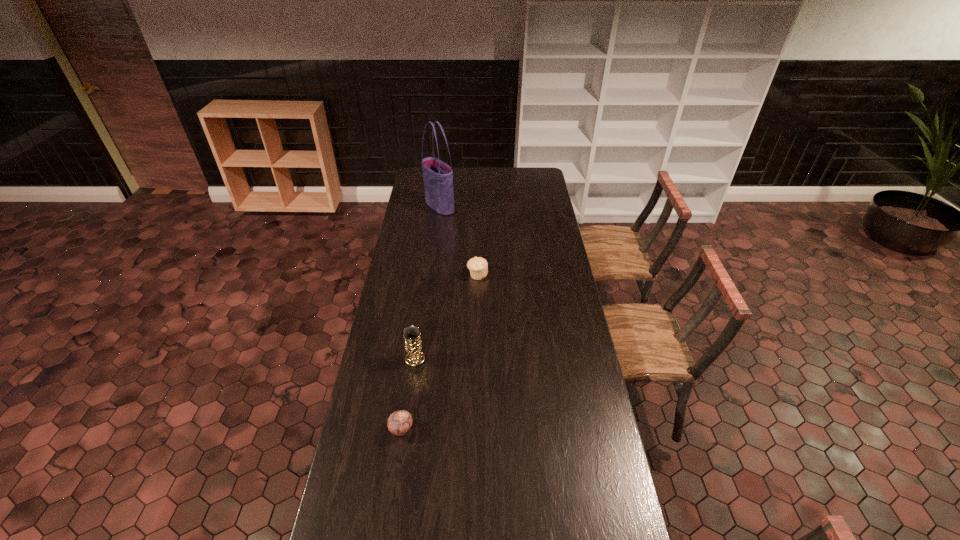
Locate an element on the screen. the farthest object is located at coordinates (438, 176).

Find the location of a particular element. the tallest object is located at coordinates (438, 176).

Locate an element on the screen. Image resolution: width=960 pixels, height=540 pixels. the third shortest object is located at coordinates (413, 345).

The image size is (960, 540). In order to click on chalice in this screenshot , I will do `click(413, 345)`.

You are a GUI agent. You are given a task and a screenshot of the screen. Output one action in this format:
    pyautogui.click(x=<x>, y=<y>)
    Task: Click on the farther muffin
    The height and width of the screenshot is (540, 960).
    Given the screenshot: What is the action you would take?
    pyautogui.click(x=478, y=266)

Where is `the third nearest object`? the third nearest object is located at coordinates (478, 266).

Find the location of a particular element. The image size is (960, 540). the shortest object is located at coordinates (399, 422).

The width and height of the screenshot is (960, 540). Find the location of `the nearer muffin`. the nearer muffin is located at coordinates (399, 422).

Locate an element on the screen. This screenshot has width=960, height=540. vacant area situated 0.230m on the back of the farthest object is located at coordinates (444, 178).

Where is `free space located 0.360m on the right of the chalice`? free space located 0.360m on the right of the chalice is located at coordinates (519, 359).